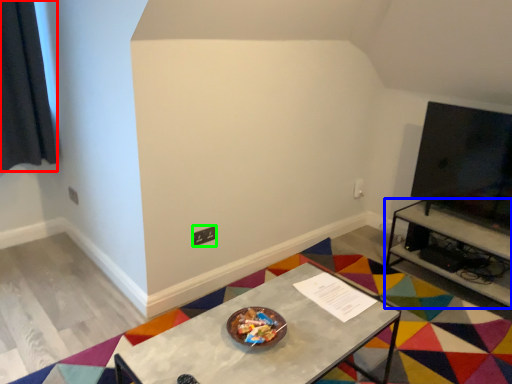
Question: Which is nearer to the curtain (highlighted by a red box)? table (highlighted by a blue box) or square (highlighted by a green box).

Choices:
 (A) table
 (B) square

Answer: (B)